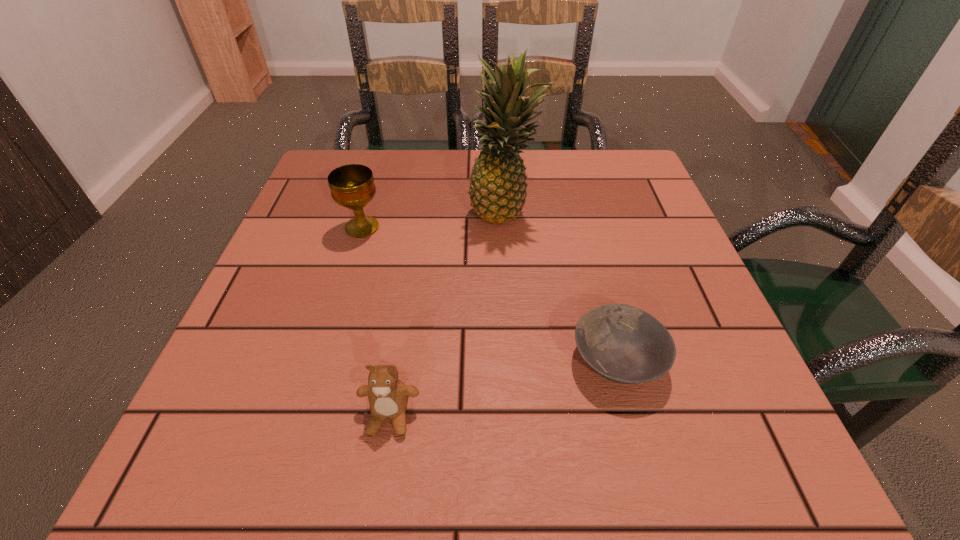
The width and height of the screenshot is (960, 540). Identify the location of free space at the near left corner of the desktop. (289, 427).

Image resolution: width=960 pixels, height=540 pixels. I want to click on vacant space at the far right corner of the desktop, so click(594, 165).

Where is `vacant space at the near right corner`? The width and height of the screenshot is (960, 540). vacant space at the near right corner is located at coordinates (755, 481).

At what (x,y) coordinates should I click in order to perform the action: click on free space between the tallest object and the teddy bear. Please return your answer as a coordinate pair (x, y). The height and width of the screenshot is (540, 960). Looking at the image, I should click on (447, 314).

Locate an element on the screen. This screenshot has height=540, width=960. vacant point located between the third object from right to left and the pineapple is located at coordinates (447, 314).

Locate an element on the screen. unoccupied area between the third tallest object and the rightmost object is located at coordinates (503, 388).

At what (x,y) coordinates should I click in order to perform the action: click on free space between the chalice and the pineapple. Please return your answer as a coordinate pair (x, y). This screenshot has height=540, width=960. Looking at the image, I should click on (433, 219).

This screenshot has width=960, height=540. I want to click on vacant space in between the second object from left to right and the rightmost object, so click(503, 388).

This screenshot has height=540, width=960. Find the location of `free space between the teddy bear and the tallest object`. free space between the teddy bear and the tallest object is located at coordinates (447, 314).

At what (x,y) coordinates should I click in order to perform the action: click on empty space between the shortest object and the teddy bear. Please return your answer as a coordinate pair (x, y). This screenshot has height=540, width=960. Looking at the image, I should click on tap(503, 388).